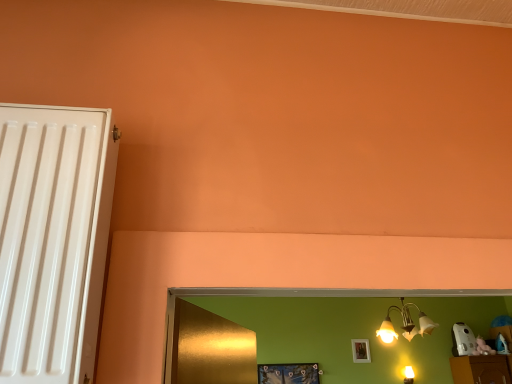
This screenshot has width=512, height=384. What do you see at coordinates (288, 373) in the screenshot?
I see `metallic blue picture frame at lower center, which is the second picture frame in back-to-front order` at bounding box center [288, 373].

Measure the distance between white matte picture frame at upper center, which appears as the 1th picture frame when viewed from the right, and camera.

white matte picture frame at upper center, which appears as the 1th picture frame when viewed from the right, is 2.46 meters from camera.

You are a GUI agent. You are given a task and a screenshot of the screen. Output one action in this format:
    pyautogui.click(x=<x>, y=<y>)
    Task: Click on the metallic blue picture frame at lower center, acting as the 2th picture frame starting from the right
    The height and width of the screenshot is (384, 512).
    Given the screenshot: What is the action you would take?
    point(288,373)

Is metallic gold chandelier at upper right wider or thinner than metallic blue picture frame at lower center, acting as the 2th picture frame starting from the right?

Clearly, metallic gold chandelier at upper right has more width compared to metallic blue picture frame at lower center, acting as the 2th picture frame starting from the right.

From the picture: Which is closer, (430, 319) or (263, 369)?

The point (263, 369) is in front.

Can you confirm if metallic gold chandelier at upper right is positioned to the left of metallic blue picture frame at lower center, the 1th picture frame in the front-to-back sequence?

Incorrect, metallic gold chandelier at upper right is not on the left side of metallic blue picture frame at lower center, the 1th picture frame in the front-to-back sequence.

Does metallic gold chandelier at upper right lie in front of metallic blue picture frame at lower center, the 1th picture frame in the front-to-back sequence?

Yes, metallic gold chandelier at upper right is closer to the viewer.

Is metallic gold chandelier at upper right looking in the opposite direction of white matte picture frame at upper center, acting as the 2th picture frame starting from the left?

Correct, metallic gold chandelier at upper right is looking away from white matte picture frame at upper center, acting as the 2th picture frame starting from the left.

Is metallic gold chandelier at upper right in front of or behind white matte picture frame at upper center, acting as the 2th picture frame starting from the left, in the image?

metallic gold chandelier at upper right is positioned closer to the viewer than white matte picture frame at upper center, acting as the 2th picture frame starting from the left.

Who is taller, metallic gold chandelier at upper right or white matte picture frame at upper center, which is the first picture frame in back-to-front order?

Standing taller between the two is metallic gold chandelier at upper right.

Which point is more distant from viewer, (352, 340) or (384, 322)?

Positioned behind is point (384, 322).

From the image's perspective, would you say white matte picture frame at upper center, which appears as the 1th picture frame when viewed from the right, is shown under metallic gold chandelier at upper right?

Yes, from the image's perspective, white matte picture frame at upper center, which appears as the 1th picture frame when viewed from the right, is beneath metallic gold chandelier at upper right.

Is white matte picture frame at upper center, which appears as the 1th picture frame when viewed from the right, facing towards metallic gold chandelier at upper right?

Yes, white matte picture frame at upper center, which appears as the 1th picture frame when viewed from the right, is facing metallic gold chandelier at upper right.

Where is `lamp above the white matte picture frame at upper center, which appears as the 1th picture frame when viewed from the right (from a real-world perspective)`? The image size is (512, 384). lamp above the white matte picture frame at upper center, which appears as the 1th picture frame when viewed from the right (from a real-world perspective) is located at coordinates (405, 324).

Can we say white matte picture frame at upper center, arranged as the 2th picture frame when viewed from the front, lies outside metallic blue picture frame at lower center, acting as the 2th picture frame starting from the right?

Yes, white matte picture frame at upper center, arranged as the 2th picture frame when viewed from the front, is located beyond the bounds of metallic blue picture frame at lower center, acting as the 2th picture frame starting from the right.

Considering the relative sizes of white matte picture frame at upper center, which appears as the 1th picture frame when viewed from the right, and metallic blue picture frame at lower center, the first picture frame when ordered from left to right, in the image provided, is white matte picture frame at upper center, which appears as the 1th picture frame when viewed from the right, taller than metallic blue picture frame at lower center, the first picture frame when ordered from left to right,?

Yes, white matte picture frame at upper center, which appears as the 1th picture frame when viewed from the right, is taller than metallic blue picture frame at lower center, the first picture frame when ordered from left to right.

Who is bigger, white matte picture frame at upper center, acting as the 2th picture frame starting from the left, or metallic blue picture frame at lower center, acting as the 2th picture frame starting from the right?

metallic blue picture frame at lower center, acting as the 2th picture frame starting from the right, is bigger.

How different are the orientations of white matte picture frame at upper center, acting as the 2th picture frame starting from the left, and metallic blue picture frame at lower center, the first picture frame when ordered from left to right, in degrees?

The angular difference between white matte picture frame at upper center, acting as the 2th picture frame starting from the left, and metallic blue picture frame at lower center, the first picture frame when ordered from left to right, is 1.26 degrees.

Is metallic blue picture frame at lower center, the 1th picture frame in the front-to-back sequence, looking in the opposite direction of metallic gold chandelier at upper right?

That's not correct — metallic blue picture frame at lower center, the 1th picture frame in the front-to-back sequence, is not looking away from metallic gold chandelier at upper right.

Based on the photo, from the image's perspective, which one is positioned lower, metallic blue picture frame at lower center, acting as the 2th picture frame starting from the right, or metallic gold chandelier at upper right?

metallic blue picture frame at lower center, acting as the 2th picture frame starting from the right, from the image's perspective.

In the scene shown: From their relative heights in the image, would you say metallic blue picture frame at lower center, which is the second picture frame in back-to-front order, is taller or shorter than metallic gold chandelier at upper right?

In the image, metallic blue picture frame at lower center, which is the second picture frame in back-to-front order, appears to be shorter than metallic gold chandelier at upper right.

Is metallic blue picture frame at lower center, the first picture frame when ordered from left to right, placed right next to metallic gold chandelier at upper right?

metallic blue picture frame at lower center, the first picture frame when ordered from left to right, is not next to metallic gold chandelier at upper right, and they're not touching.

From a real-world perspective, between metallic blue picture frame at lower center, acting as the 2th picture frame starting from the right, and white matte picture frame at upper center, arranged as the 2th picture frame when viewed from the front, who is vertically lower?

From a 3D spatial view, metallic blue picture frame at lower center, acting as the 2th picture frame starting from the right, is below.

Can you confirm if metallic blue picture frame at lower center, the first picture frame when ordered from left to right, is smaller than white matte picture frame at upper center, which appears as the 1th picture frame when viewed from the right?

No, metallic blue picture frame at lower center, the first picture frame when ordered from left to right, is not smaller than white matte picture frame at upper center, which appears as the 1th picture frame when viewed from the right.

In the scene shown: Can you confirm if metallic blue picture frame at lower center, which is the second picture frame in back-to-front order, is wider than white matte picture frame at upper center, which appears as the 1th picture frame when viewed from the right?

Correct, the width of metallic blue picture frame at lower center, which is the second picture frame in back-to-front order, exceeds that of white matte picture frame at upper center, which appears as the 1th picture frame when viewed from the right.

Does metallic blue picture frame at lower center, the 1th picture frame in the front-to-back sequence, touch white matte picture frame at upper center, acting as the 2th picture frame starting from the left?

No, metallic blue picture frame at lower center, the 1th picture frame in the front-to-back sequence, is not making contact with white matte picture frame at upper center, acting as the 2th picture frame starting from the left.

Locate an element on the screen. This screenshot has width=512, height=384. lamp in front of the metallic blue picture frame at lower center, which is the second picture frame in back-to-front order is located at coordinates (405, 324).

This screenshot has height=384, width=512. Identify the location of picture frame on the right of the metallic gold chandelier at upper right. (361, 351).

Looking at this image, considering their positions, is metallic blue picture frame at lower center, which is the second picture frame in back-to-front order, positioned closer to white matte picture frame at upper center, arranged as the 2th picture frame when viewed from the front, than metallic gold chandelier at upper right?

metallic gold chandelier at upper right is closer to white matte picture frame at upper center, arranged as the 2th picture frame when viewed from the front.

Considering their positions, is white matte picture frame at upper center, which appears as the 1th picture frame when viewed from the right, positioned further to metallic gold chandelier at upper right than metallic blue picture frame at lower center, which is the second picture frame in back-to-front order?

Among the two, metallic blue picture frame at lower center, which is the second picture frame in back-to-front order, is located further to metallic gold chandelier at upper right.

Estimate the real-world distances between objects in this image. Which object is further from metallic gold chandelier at upper right, metallic blue picture frame at lower center, acting as the 2th picture frame starting from the right, or white matte picture frame at upper center, acting as the 2th picture frame starting from the left?

metallic blue picture frame at lower center, acting as the 2th picture frame starting from the right, is positioned further to the anchor metallic gold chandelier at upper right.

Which object lies nearer to the anchor point metallic blue picture frame at lower center, the first picture frame when ordered from left to right, white matte picture frame at upper center, which is the first picture frame in back-to-front order, or metallic gold chandelier at upper right?

Based on the image, white matte picture frame at upper center, which is the first picture frame in back-to-front order, appears to be nearer to metallic blue picture frame at lower center, the first picture frame when ordered from left to right.

In the scene shown: When comparing their distances from white matte picture frame at upper center, acting as the 2th picture frame starting from the left, does metallic gold chandelier at upper right or metallic blue picture frame at lower center, the 1th picture frame in the front-to-back sequence, seem closer?

metallic gold chandelier at upper right is positioned closer to the anchor white matte picture frame at upper center, acting as the 2th picture frame starting from the left.

Looking at the image, which one is located closer to metallic blue picture frame at lower center, the 1th picture frame in the front-to-back sequence, metallic gold chandelier at upper right or white matte picture frame at upper center, which appears as the 1th picture frame when viewed from the right?

white matte picture frame at upper center, which appears as the 1th picture frame when viewed from the right, is closer to metallic blue picture frame at lower center, the 1th picture frame in the front-to-back sequence.

The height and width of the screenshot is (384, 512). Identify the location of picture frame between metallic gold chandelier at upper right and white matte picture frame at upper center, which is the first picture frame in back-to-front order, along the z-axis. (288, 373).